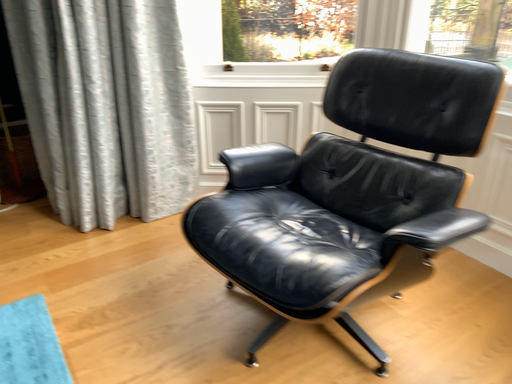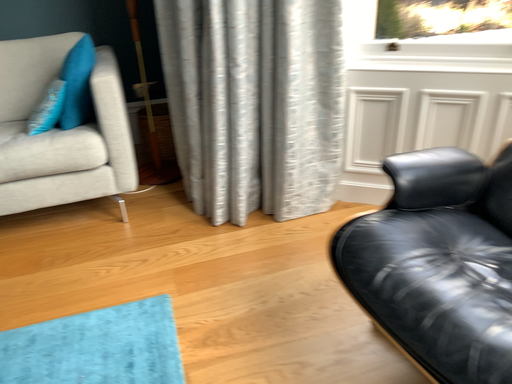
Question: How did the camera likely rotate when shooting the video?

Choices:
 (A) rotated right
 (B) rotated left

Answer: (B)